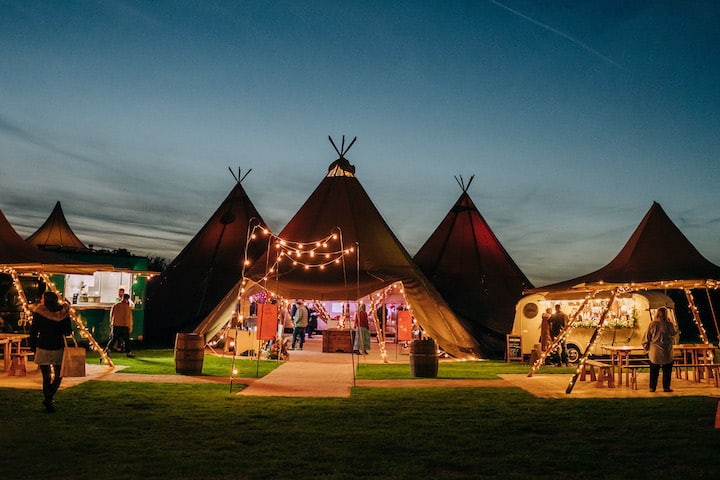
I want to click on teepee, so click(363, 193).